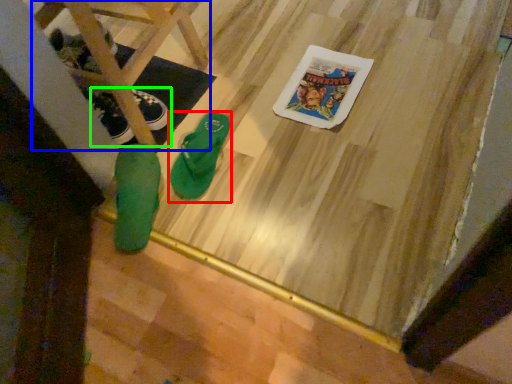
Question: Which object is positioned farthest from footwear (highlighted by a red box)? Select from furniture (highlighted by a blue box) and footwear (highlighted by a green box).

Choices:
 (A) furniture
 (B) footwear

Answer: (A)